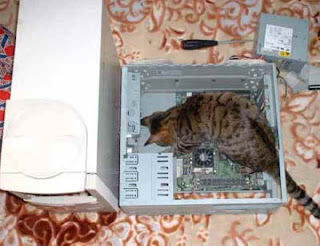
You are a GUI agent. You are given a task and a screenshot of the screen. Output one action in this format:
    pyautogui.click(x=<x>, y=<y>)
    Task: Click on the case of the computer tower
    The image size is (320, 246).
    Given the screenshot: What is the action you would take?
    pyautogui.click(x=57, y=78)